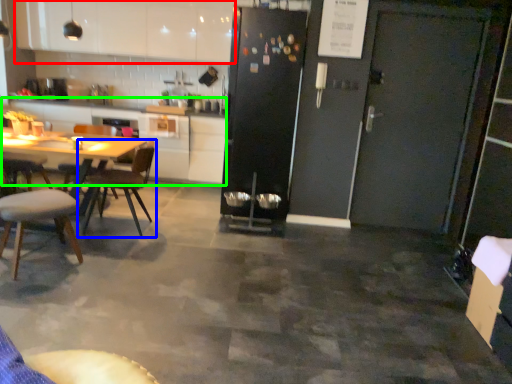
Question: Which object is positioned farthest from cabinetry (highlighted by a red box)? Select from chair (highlighted by a blue box) and counter top (highlighted by a green box).

Choices:
 (A) chair
 (B) counter top

Answer: (A)